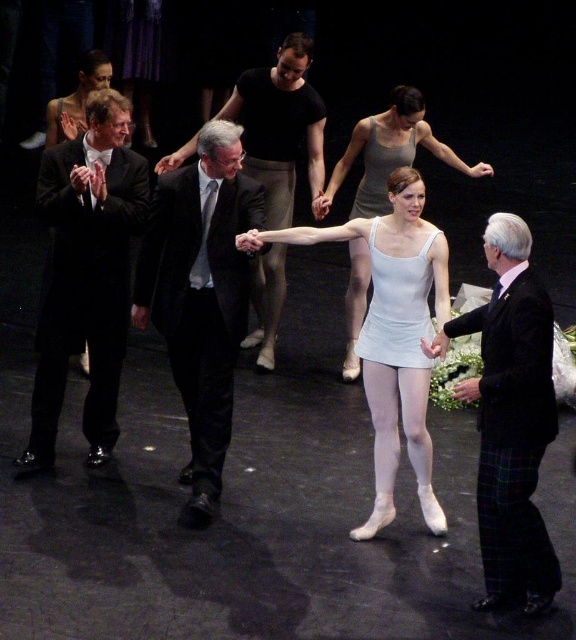
Question: Is white matte leotard at center to the right of white matte tank top at center from the viewer's perspective?

Choices:
 (A) yes
 (B) no

Answer: (A)

Question: Which point is farther from the camera taking this photo?

Choices:
 (A) (350, 316)
 (B) (377, 417)
 (C) (536, 572)

Answer: (A)

Question: Can you confirm if black plaid suit at right is positioned above white satin leotard at center?

Choices:
 (A) no
 (B) yes

Answer: (A)

Question: Considering the real-world distances, which object is closest to the black satin suit at left?

Choices:
 (A) white matte leotard at center
 (B) white satin leotard at center
 (C) black silk suit at center

Answer: (C)

Question: Is white satin leotard at center to the left of plaid fabric pants at lower right from the viewer's perspective?

Choices:
 (A) no
 (B) yes

Answer: (B)

Question: Estimate the real-world distances between objects in this image. Which object is farther from the plaid fabric pants at lower right?

Choices:
 (A) black plaid suit at right
 (B) white matte tank top at center
 (C) white satin leotard at center
 (D) white matte leotard at center

Answer: (D)